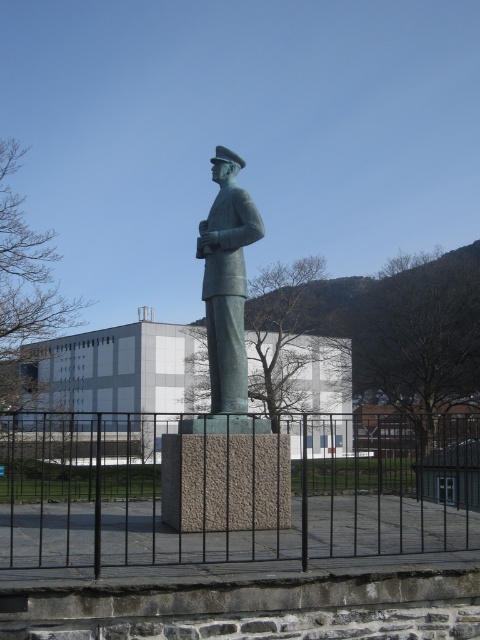
You are standing in front of the statue and want to take a photo of the statue without the black metal fence at center appearing in the frame. Based on the statue and the fence location, where should you position yourself relative to the statue to avoid the fence?

To avoid the black metal fence at center in the photo, position yourself to the left or right of the statue since the fence is centrally located at point (220, 493).

You are a photographer trying to capture a clear shot of the bronze statue at center. However, you notice the black metal fence at center might obstruct your view. Based on the scene description, can you determine if the fence is tall enough to block the statue from view?

The black metal fence at center is much taller than the bronze statue at center, so it would likely block the statue from view completely.